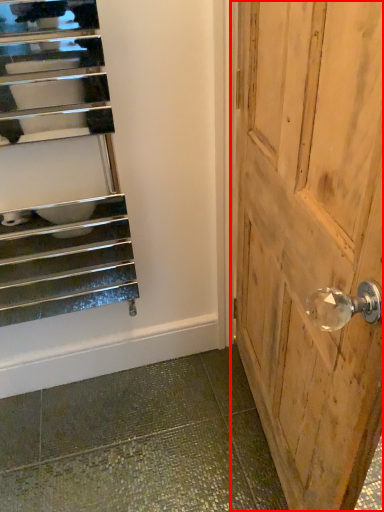
Question: From the image's perspective, what is the correct spatial positioning of door (annotated by the red box) in reference to stairs?

Choices:
 (A) above
 (B) below

Answer: (B)